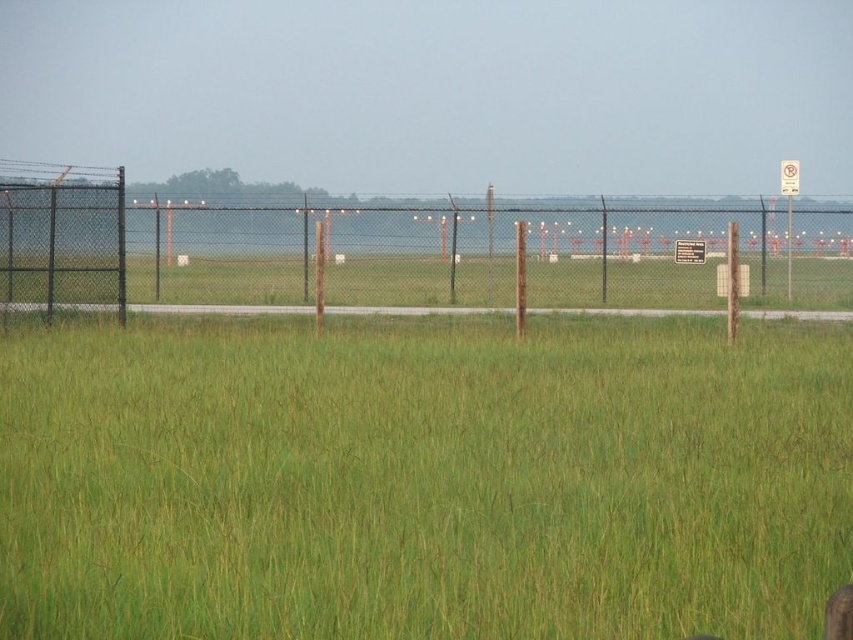
Question: Can you confirm if green grassy field at center is bigger than black chain-link fence at center?

Choices:
 (A) yes
 (B) no

Answer: (B)

Question: Which point is farther to the camera?

Choices:
 (A) black chain-link fence at center
 (B) green grassy field at center

Answer: (A)

Question: Is green grassy field at center bigger than black chain-link fence at center?

Choices:
 (A) yes
 (B) no

Answer: (B)

Question: Does green grassy field at center appear on the left side of black chain-link fence at center?

Choices:
 (A) yes
 (B) no

Answer: (B)